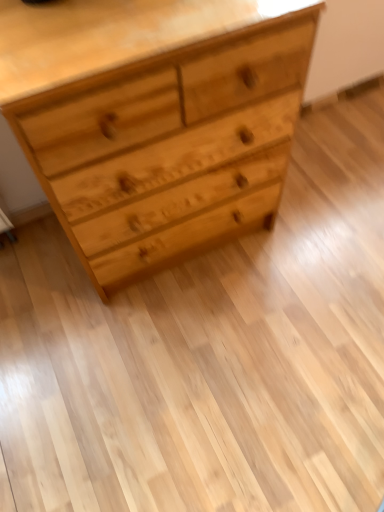
Identify the location of free space in front of natural wood drawer at center. (219, 334).